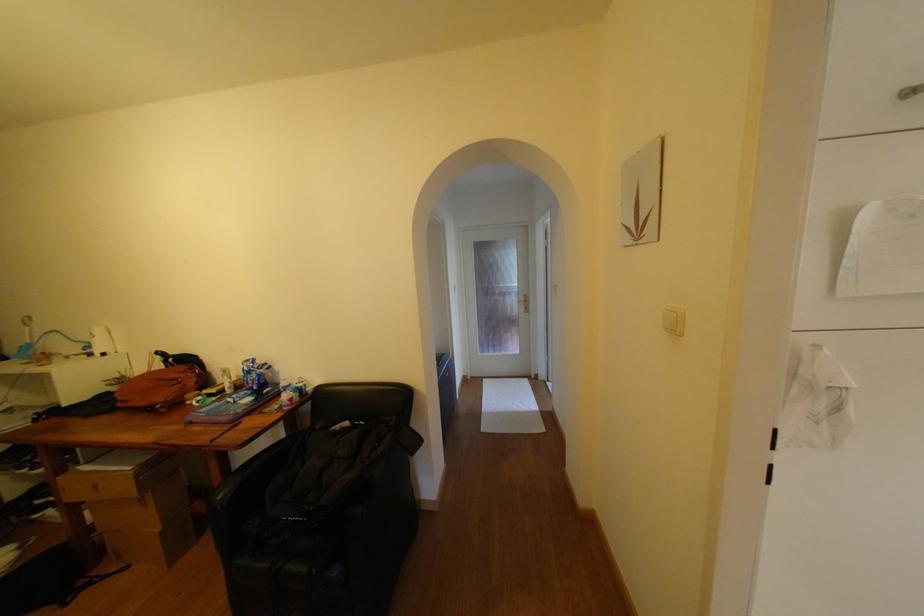
This screenshot has width=924, height=616. What do you see at coordinates (254, 475) in the screenshot?
I see `the black chair armrest` at bounding box center [254, 475].